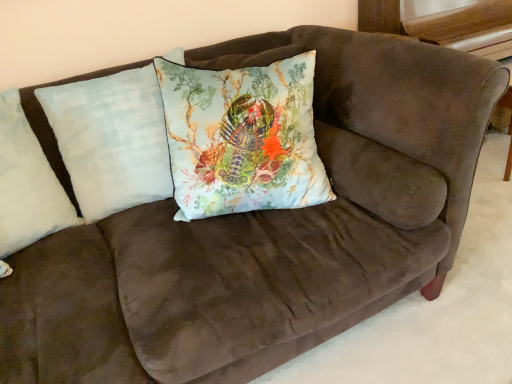
Question: Does light blue fabric pillow at center, positioned as the second pillow in left-to-right order, come in front of light blue fabric pillow at center, the first pillow viewed from the right?

Choices:
 (A) yes
 (B) no

Answer: (B)

Question: Is light blue fabric pillow at center, positioned as the second pillow in left-to-right order, far from light blue fabric pillow at center, the third pillow in the left-to-right sequence?

Choices:
 (A) no
 (B) yes

Answer: (A)

Question: Does light blue fabric pillow at center, positioned as the second pillow in left-to-right order, have a smaller size compared to light blue fabric pillow at center, the first pillow viewed from the right?

Choices:
 (A) yes
 (B) no

Answer: (A)

Question: Is light blue fabric pillow at center, the first pillow viewed from the right, completely or partially inside light blue fabric pillow at center, arranged as the 2th pillow when viewed from the right?

Choices:
 (A) no
 (B) yes

Answer: (A)

Question: Could you tell me if light blue fabric pillow at center, positioned as the second pillow in left-to-right order, is facing light blue fabric pillow at center, the third pillow in the left-to-right sequence?

Choices:
 (A) yes
 (B) no

Answer: (B)

Question: Considering the relative sizes of light blue fabric pillow at center, arranged as the 2th pillow when viewed from the right, and light blue fabric pillow at center, the third pillow in the left-to-right sequence, in the image provided, is light blue fabric pillow at center, arranged as the 2th pillow when viewed from the right, taller than light blue fabric pillow at center, the third pillow in the left-to-right sequence,?

Choices:
 (A) yes
 (B) no

Answer: (A)

Question: Considering the relative positions of light blue fabric pillow at center, the first pillow viewed from the right, and white soft pillow at left, arranged as the third pillow when viewed from the right, in the image provided, is light blue fabric pillow at center, the first pillow viewed from the right, to the left of white soft pillow at left, arranged as the third pillow when viewed from the right, from the viewer's perspective?

Choices:
 (A) no
 (B) yes

Answer: (A)

Question: Can you confirm if light blue fabric pillow at center, the first pillow viewed from the right, is positioned to the right of white soft pillow at left, arranged as the third pillow when viewed from the right?

Choices:
 (A) no
 (B) yes

Answer: (B)

Question: Is light blue fabric pillow at center, the third pillow in the left-to-right sequence, bigger than white soft pillow at left, arranged as the third pillow when viewed from the right?

Choices:
 (A) no
 (B) yes

Answer: (B)

Question: From the image's perspective, is light blue fabric pillow at center, the third pillow in the left-to-right sequence, above white soft pillow at left, the first pillow viewed from the left?

Choices:
 (A) yes
 (B) no

Answer: (A)

Question: Is light blue fabric pillow at center, the first pillow viewed from the right, far from white soft pillow at left, the first pillow viewed from the left?

Choices:
 (A) no
 (B) yes

Answer: (A)

Question: Is light blue fabric pillow at center, the first pillow viewed from the right, shorter than white soft pillow at left, the first pillow viewed from the left?

Choices:
 (A) yes
 (B) no

Answer: (B)

Question: From a real-world perspective, is white soft pillow at left, arranged as the third pillow when viewed from the right, under light blue fabric pillow at center, positioned as the second pillow in left-to-right order?

Choices:
 (A) yes
 (B) no

Answer: (B)